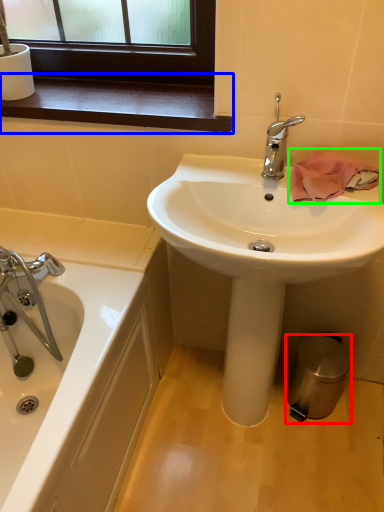
Question: Which object is positioned closest to trash bin/can (highlighted by a red box)? Select from window sill (highlighted by a blue box) and bath towel (highlighted by a green box).

Choices:
 (A) window sill
 (B) bath towel

Answer: (B)